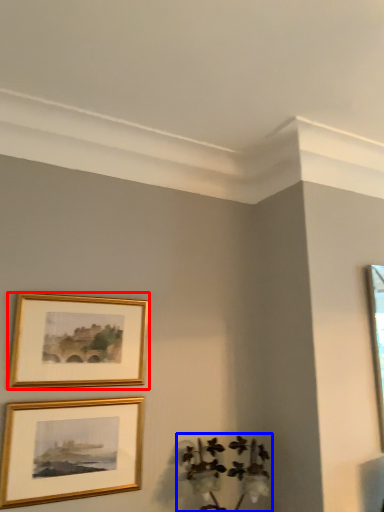
Question: Which object is closer to the camera taking this photo, picture frame (highlighted by a red box) or plant (highlighted by a blue box)?

Choices:
 (A) picture frame
 (B) plant

Answer: (B)